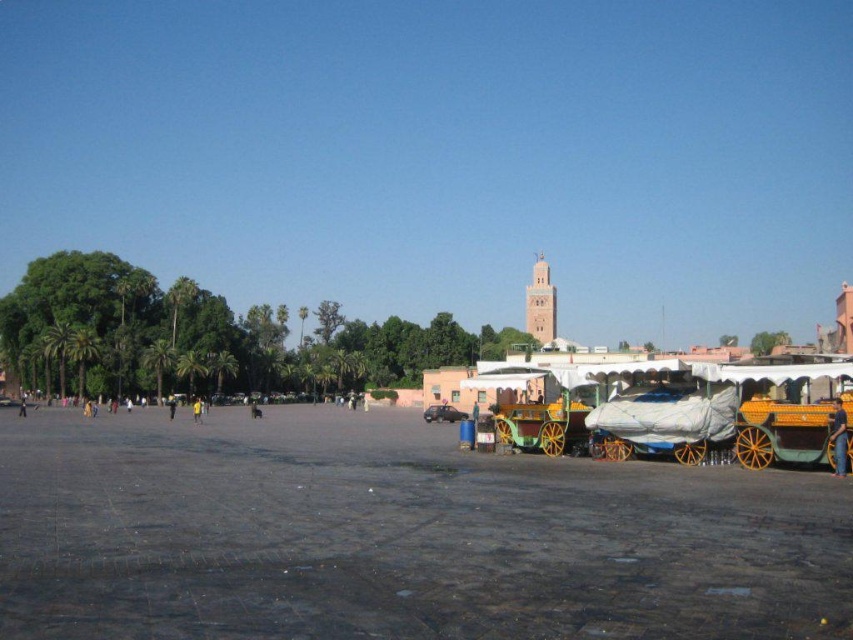
You are standing at the center of the square and want to reach the orange wood horse cart at lower right. Which direction should you walk to get there?

You should walk towards the lower right direction to reach the orange wood horse cart at lower right.

You are a delivery person who needs to deliver a package from the smooth stone pavement at center to the orange fabric cart at lower right. The delivery vehicle can only travel up to 50 feet. Can you complete the delivery without exceeding the vehicle range?

The distance between the smooth stone pavement at center and the orange fabric cart at lower right is 64.45 feet, which exceeds the vehicle range of 50 feet. Therefore, the delivery cannot be completed without exceeding the vehicle range.

From the picture: You are a delivery person standing on the smooth stone pavement at center and need to reach the orange wood horse cart at lower right. Considering the height difference between them, what challenge might you face?

The smooth stone pavement at center is much taller than the orange wood horse cart at lower right, so you might have difficulty stepping down from the higher pavement to the lower cart due to the height difference.